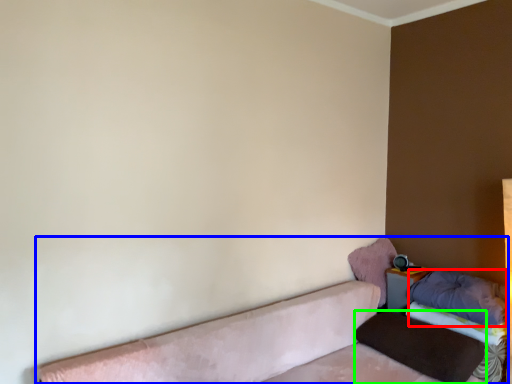
Question: Estimate the real-world distances between objects in this image. Which object is closer to pillow (highlighted by a red box), studio couch (highlighted by a blue box) or pillow (highlighted by a green box)?

Choices:
 (A) studio couch
 (B) pillow

Answer: (B)